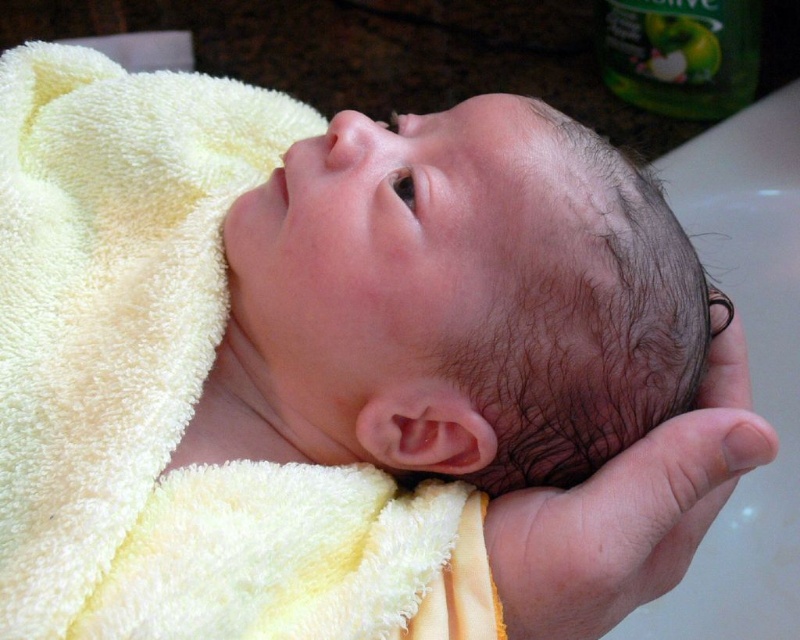
You are a photographer taking a closeup shot of a newborn baby. You notice the smooth skin head at center and the smooth skin hand at center in your frame. Based on their sizes in the image, which object would appear larger when printed as a poster?

The smooth skin head at center would appear larger when printed as a poster because it is much taller than the smooth skin hand at center in the image.

Based on the scene described, can you determine which object, the smooth skin head at center or the smooth skin hand at center, has a greater width?

The smooth skin head at center has a greater width than the smooth skin hand at center.

You are a photographer taking a closeup shot of a newborn baby. You notice the smooth skin head at center and the smooth skin hand at center in the image. Which object is located above the other?

The smooth skin head at center is positioned over smooth skin hand at center.